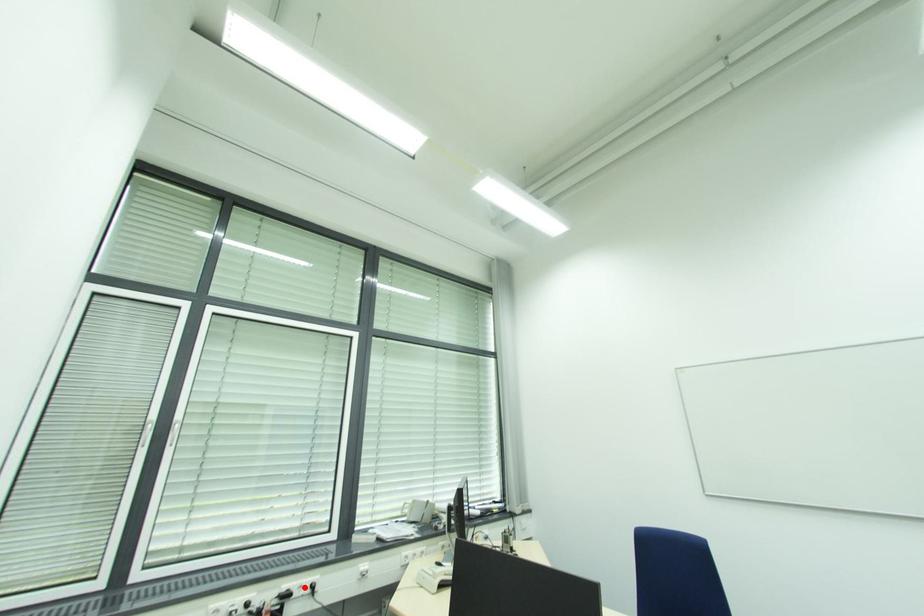
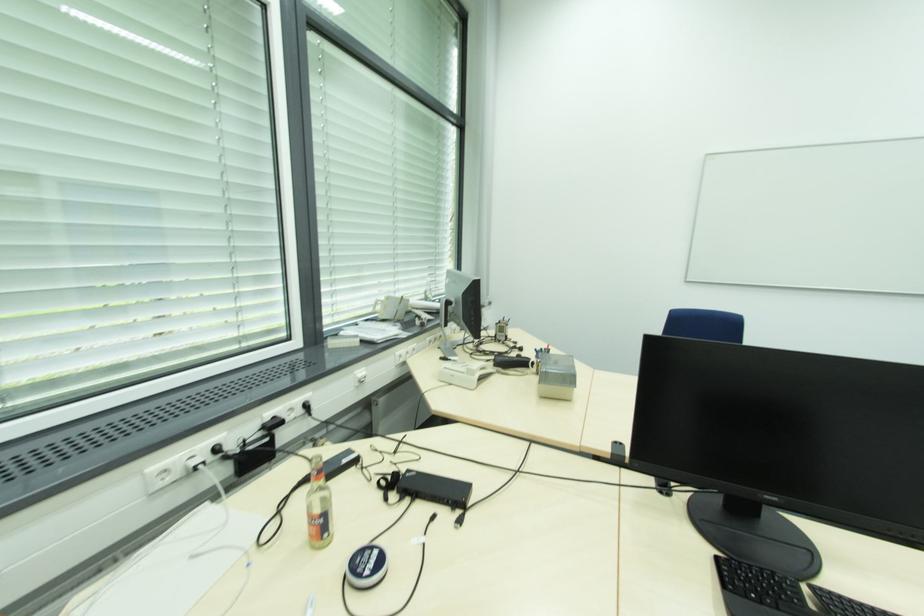
Where in the second image is the point corresponding to the highlighted location from the first image?

(294, 410)